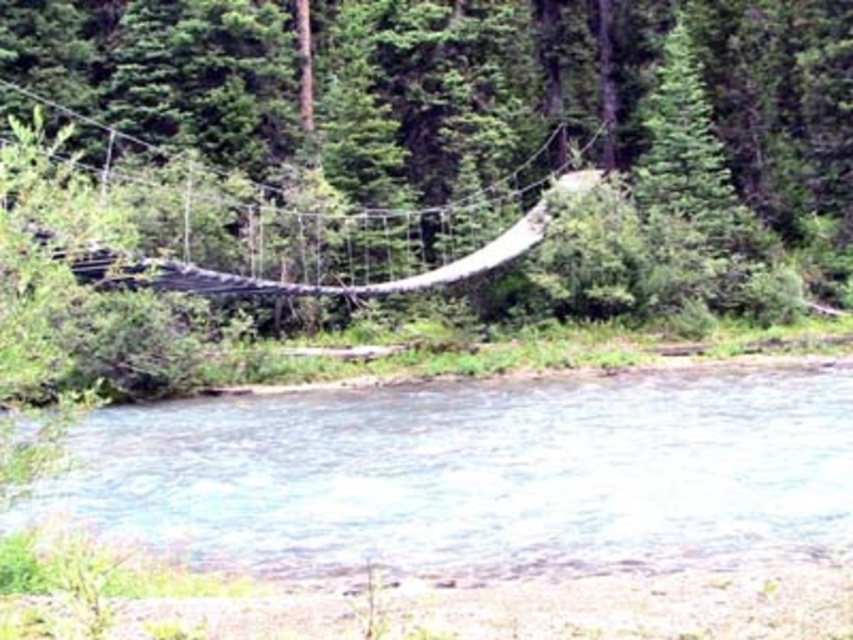
You are a hiker who wants to cross the suspension bridge safely. You notice the green leafy tree at center and the clear water at lower center. Which object is bigger in size?

The green leafy tree at center is larger in size compared to the clear water at lower center, so the green leafy tree at center is bigger.

You are standing on the suspension bridge depicted in the scene. Directly below you, you notice a point marked at coordinates [457,129]. What object does this point indicate?

The point at coordinates [457,129] marks a green leafy tree at center.